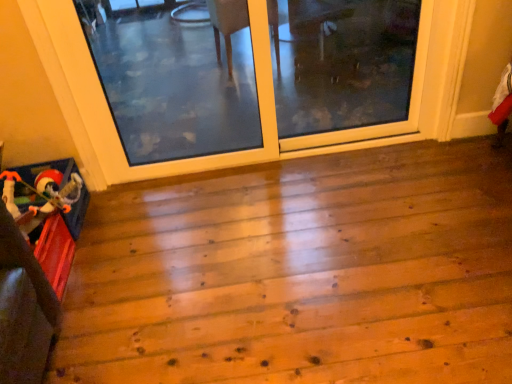
Question: From a real-world perspective, is clear glass screen door at center, which is counted as the second screen door, starting from the right, positioned above or below transparent glass screen door at upper center, which is the first screen door in right-to-left order?

Choices:
 (A) above
 (B) below

Answer: (A)

Question: Is clear glass screen door at center, which is counted as the second screen door, starting from the right, in front of or behind transparent glass screen door at upper center, placed as the second screen door when sorted from left to right, in the image?

Choices:
 (A) behind
 (B) front

Answer: (B)

Question: Based on their relative distances, which object is farther from the clear glass screen door at center, which is counted as the second screen door, starting from the right?

Choices:
 (A) plush santa toy at lower left
 (B) transparent glass screen door at upper center, which is the first screen door in right-to-left order
 (C) wooden toy at lower left

Answer: (C)

Question: Based on their relative distances, which object is nearer to the wooden toy at lower left?

Choices:
 (A) plush santa toy at lower left
 (B) clear glass screen door at center, the 1th screen door when ordered from left to right
 (C) transparent glass screen door at upper center, placed as the second screen door when sorted from left to right

Answer: (A)